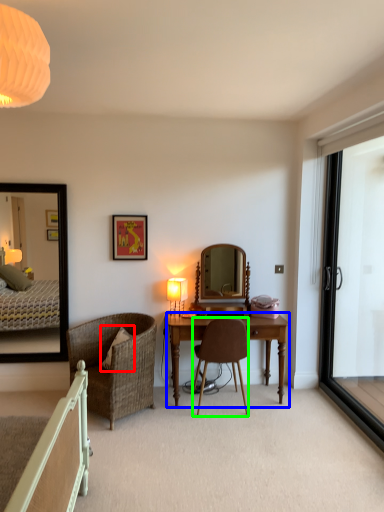
Question: Which object is the closest to the pillow (highlighted by a red box)? Choose among these: desk (highlighted by a blue box) or chair (highlighted by a green box).

Choices:
 (A) desk
 (B) chair

Answer: (B)